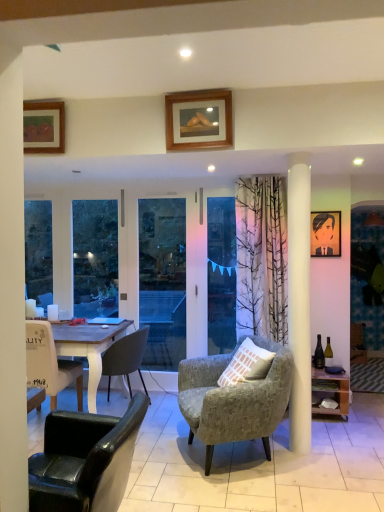
Question: Can you confirm if matte black portrait at upper right, the third picture frame in the top-to-bottom sequence, is thinner than wooden shelf at right?

Choices:
 (A) yes
 (B) no

Answer: (A)

Question: Can you confirm if matte black portrait at upper right, placed as the 3th picture frame when sorted from front to back, is shorter than wooden shelf at right?

Choices:
 (A) no
 (B) yes

Answer: (A)

Question: Can you confirm if matte black portrait at upper right, the third picture frame in the top-to-bottom sequence, is positioned to the left of wooden shelf at right?

Choices:
 (A) yes
 (B) no

Answer: (B)

Question: Is matte black portrait at upper right, which is counted as the 2th picture frame, starting from the right, not near wooden shelf at right?

Choices:
 (A) no
 (B) yes

Answer: (B)

Question: Considering the relative sizes of matte black portrait at upper right, which is counted as the 2th picture frame, starting from the right, and wooden shelf at right in the image provided, is matte black portrait at upper right, which is counted as the 2th picture frame, starting from the right, bigger than wooden shelf at right?

Choices:
 (A) yes
 (B) no

Answer: (B)

Question: Is matte black portrait at upper right, positioned as the 3th picture frame in left-to-right order, in front of or behind wooden-framed artwork at upper left, marked as the 1th picture frame in a left-to-right arrangement, in the image?

Choices:
 (A) front
 (B) behind

Answer: (B)

Question: Would you say matte black portrait at upper right, positioned as the 2th picture frame in bottom-to-top order, is to the left or to the right of wooden-framed artwork at upper left, the first picture frame from the top, in the picture?

Choices:
 (A) left
 (B) right

Answer: (B)

Question: In terms of width, does matte black portrait at upper right, the third picture frame in the top-to-bottom sequence, look wider or thinner when compared to wooden-framed artwork at upper left, marked as the 1th picture frame in a left-to-right arrangement?

Choices:
 (A) thin
 (B) wide

Answer: (A)

Question: Choose the correct answer: Is matte black portrait at upper right, positioned as the 3th picture frame in left-to-right order, inside wooden-framed artwork at upper left, acting as the fourth picture frame starting from the right, or outside it?

Choices:
 (A) outside
 (B) inside

Answer: (A)

Question: Is wooden picture frame at right, which is the 1th picture frame in bottom-to-top order, bigger or smaller than wooden shelf at right?

Choices:
 (A) small
 (B) big

Answer: (A)

Question: Is wooden picture frame at right, the 4th picture frame viewed from the top, to the left or to the right of wooden shelf at right in the image?

Choices:
 (A) right
 (B) left

Answer: (A)

Question: From the image's perspective, is wooden picture frame at right, placed as the first picture frame when sorted from back to front, located above or below wooden shelf at right?

Choices:
 (A) below
 (B) above

Answer: (B)

Question: Is wooden picture frame at right, the 4th picture frame viewed from the top, wider or thinner than wooden shelf at right?

Choices:
 (A) wide
 (B) thin

Answer: (B)

Question: In the image, is wooden picture frame at right, the 4th picture frame viewed from the top, positioned in front of or behind transparent plastic window screen at center?

Choices:
 (A) behind
 (B) front

Answer: (B)

Question: From the image's perspective, is wooden picture frame at right, which is the 1th picture frame in bottom-to-top order, above or below transparent plastic window screen at center?

Choices:
 (A) below
 (B) above

Answer: (A)